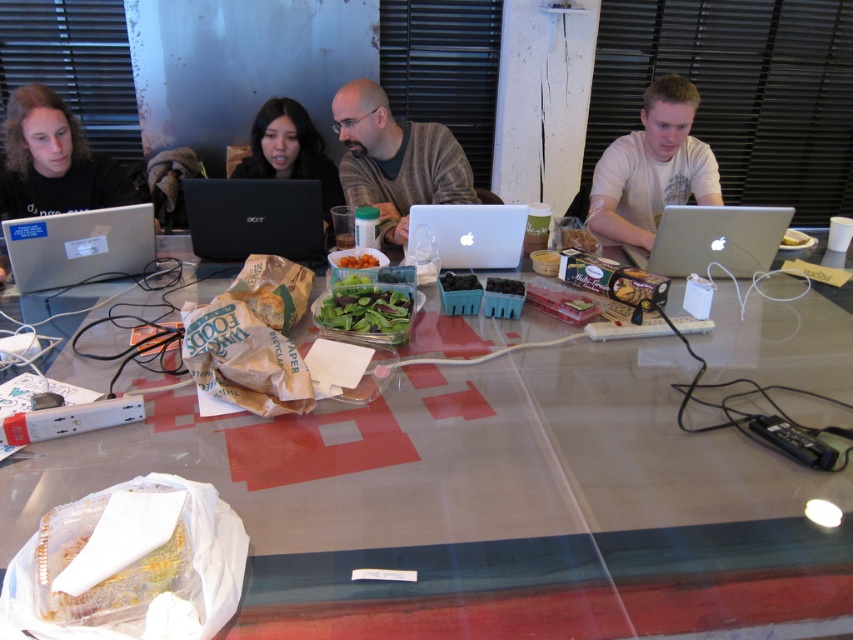
Question: Which object is positioned closest to the orange matte tomatoes at center?

Choices:
 (A) crumbly brown cookie at center
 (B) silver metallic laptop at right

Answer: (A)

Question: Can you confirm if silver metallic laptop at left is thinner than white plastic fork at upper center?

Choices:
 (A) yes
 (B) no

Answer: (B)

Question: Which point is farther to the camera?

Choices:
 (A) (454, 259)
 (B) (358, 264)

Answer: (A)

Question: Where is clear glass table at center located in relation to gray sweater at center in the image?

Choices:
 (A) below
 (B) above

Answer: (A)

Question: Is clear glass table at center bigger than white matte shirt at right?

Choices:
 (A) yes
 (B) no

Answer: (A)

Question: Which of the following is the closest to the observer?

Choices:
 (A) (793, 241)
 (B) (461, 230)
 (C) (376, 291)

Answer: (C)